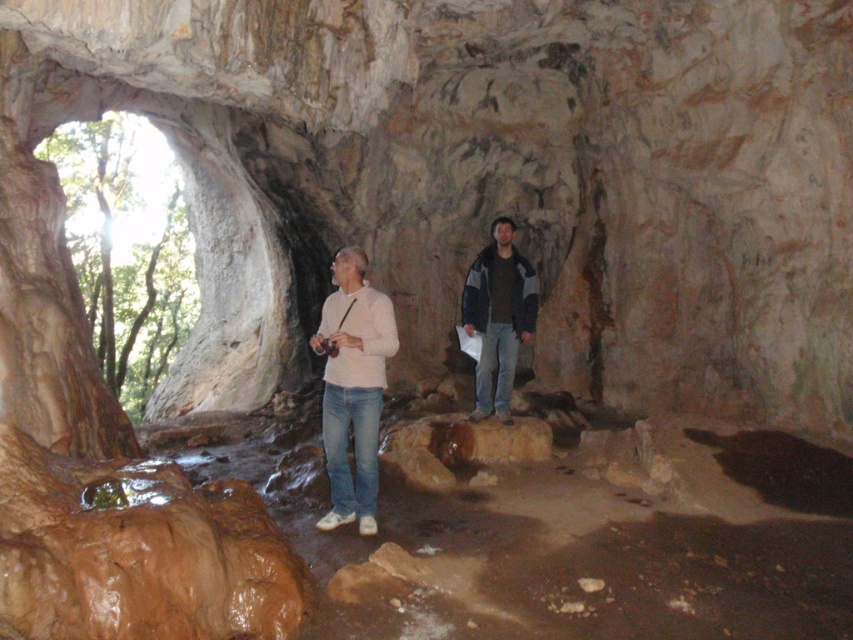
You are planning to pack a backpack for a cave exploration trip. You have both the light beige jeans at center and the dark gray fleece jacket at center. Which item should you prioritize packing if you want to save space in your backpack?

The light beige jeans at center occupies less space than the dark gray fleece jacket at center, so you should prioritize packing the light beige jeans at center to save space in your backpack.

You are planning to take a photo of the two people in the cave. To ensure both the light beige jeans at center and the white matte shirt at center are visible in the frame, which part of their clothing should you focus on first?

You should focus on the white matte shirt at center first because the light beige jeans at center is located below it, ensuring the shirt will be in the upper part of the frame while the jeans will naturally be captured below.

You are an explorer in the cave and need to place a small flashlight on the ground. You have the dark gray fleece jacket at center and the brown rough rock at center in your view. Which object should you place the flashlight on to ensure it stays stable?

You should place the flashlight on the brown rough rock at center because the dark gray fleece jacket at center is located above it, meaning the rock is on the ground and provides a stable surface.